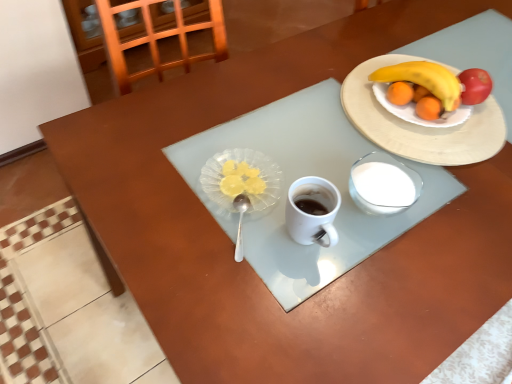
This screenshot has height=384, width=512. In order to click on free space above white ceramic plate at upper right (from a real-world perspective) in this screenshot , I will do `click(417, 108)`.